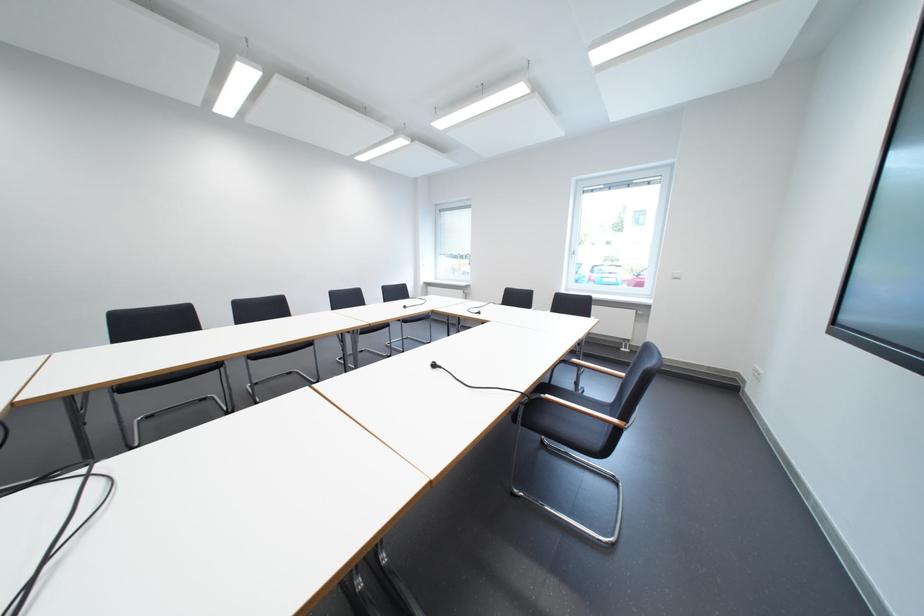
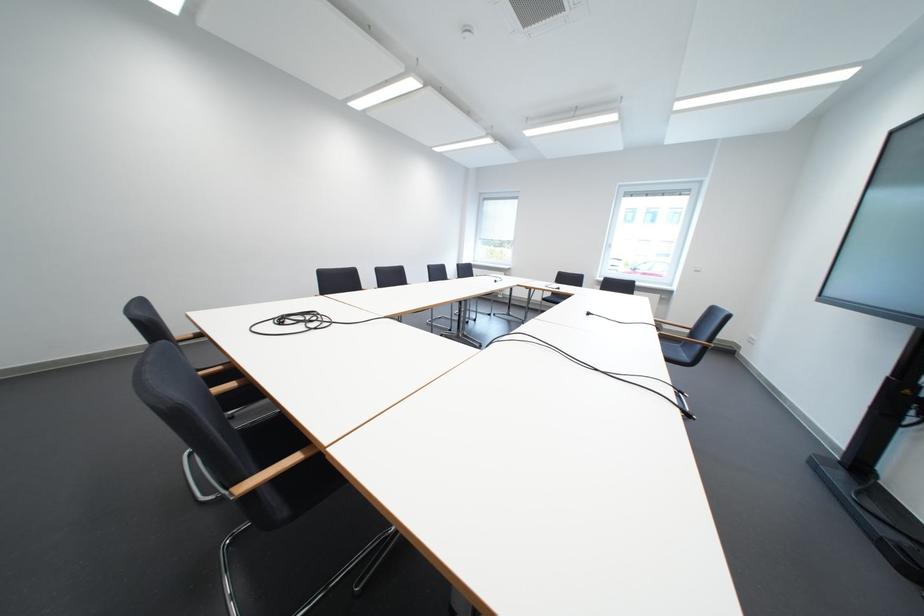
Find the pixel in the second image that matches (x=446, y=367) in the first image.

(601, 315)